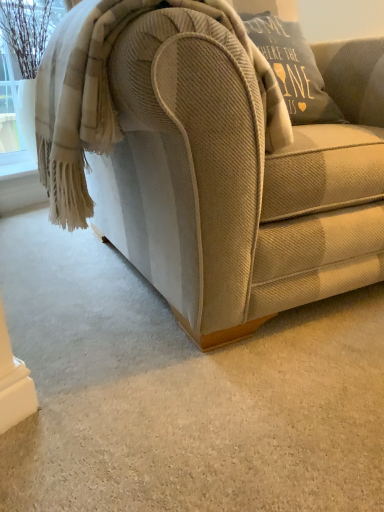
Question: Is beige woolen blanket at upper left far away from beige corduroy couch at center?

Choices:
 (A) no
 (B) yes

Answer: (A)

Question: Is beige woolen blanket at upper left looking in the opposite direction of beige corduroy couch at center?

Choices:
 (A) yes
 (B) no

Answer: (A)

Question: Is beige woolen blanket at upper left at the left side of beige corduroy couch at center?

Choices:
 (A) yes
 (B) no

Answer: (A)

Question: Can you confirm if beige woolen blanket at upper left is bigger than beige corduroy couch at center?

Choices:
 (A) no
 (B) yes

Answer: (A)

Question: Is beige woolen blanket at upper left at the right side of beige corduroy couch at center?

Choices:
 (A) yes
 (B) no

Answer: (B)

Question: Is the position of beige woolen blanket at upper left less distant than that of beige corduroy couch at center?

Choices:
 (A) no
 (B) yes

Answer: (A)

Question: Does beige corduroy couch at center have a lesser width compared to beige woolen blanket at upper left?

Choices:
 (A) no
 (B) yes

Answer: (A)

Question: From a real-world perspective, is beige corduroy couch at center under beige woolen blanket at upper left?

Choices:
 (A) yes
 (B) no

Answer: (A)

Question: Is beige corduroy couch at center bigger than beige woolen blanket at upper left?

Choices:
 (A) yes
 (B) no

Answer: (A)

Question: From the image's perspective, would you say beige corduroy couch at center is positioned over beige woolen blanket at upper left?

Choices:
 (A) no
 (B) yes

Answer: (B)

Question: Can you confirm if beige corduroy couch at center is smaller than beige woolen blanket at upper left?

Choices:
 (A) no
 (B) yes

Answer: (A)

Question: Is beige corduroy couch at center outside of beige woolen blanket at upper left?

Choices:
 (A) no
 (B) yes

Answer: (B)

Question: From the image's perspective, is beige woolen blanket at upper left above or below beige corduroy couch at center?

Choices:
 (A) below
 (B) above

Answer: (A)